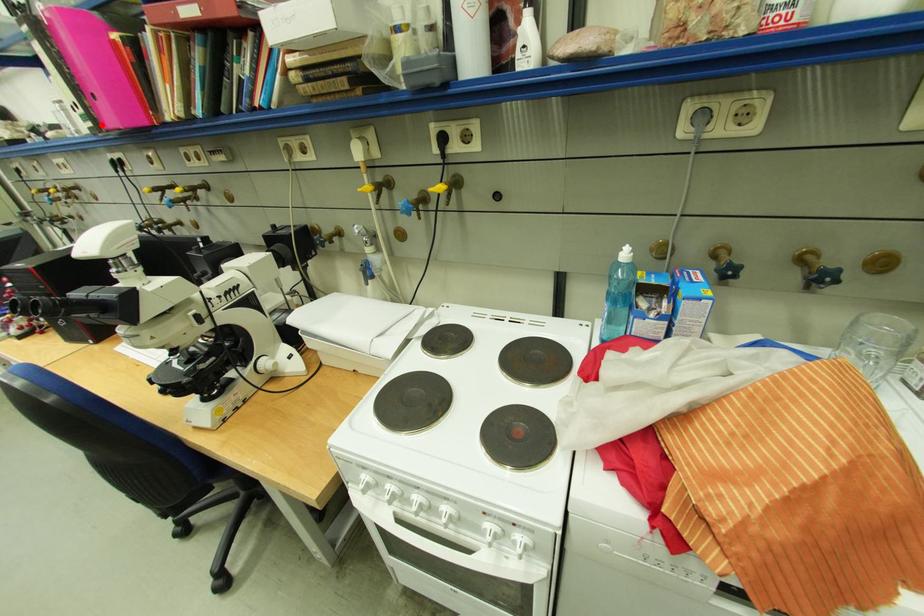
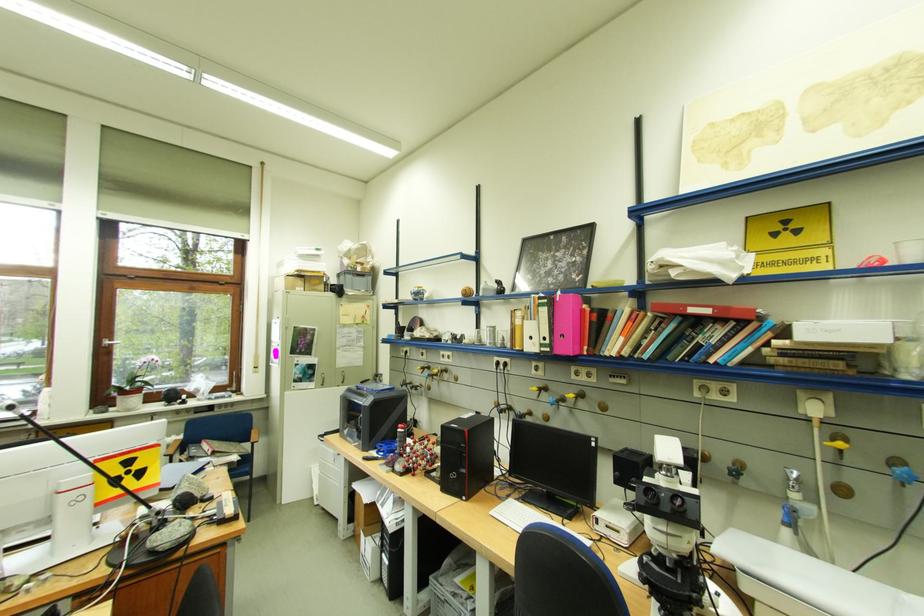
Question: I am providing you with two images of the same scene from different viewpoints. Given a red point in image1, look at the same physical point in image2. Is it:

Choices:
 (A) Closer to the viewpoint
 (B) Farther from the viewpoint

Answer: (A)